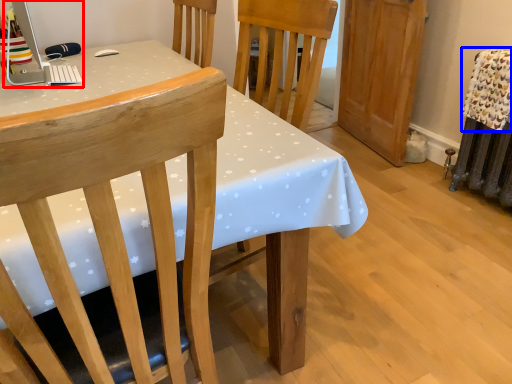
Question: Which point is further to the camera, desktop computer (highlighted by a red box) or blanket (highlighted by a blue box)?

Choices:
 (A) desktop computer
 (B) blanket

Answer: (B)